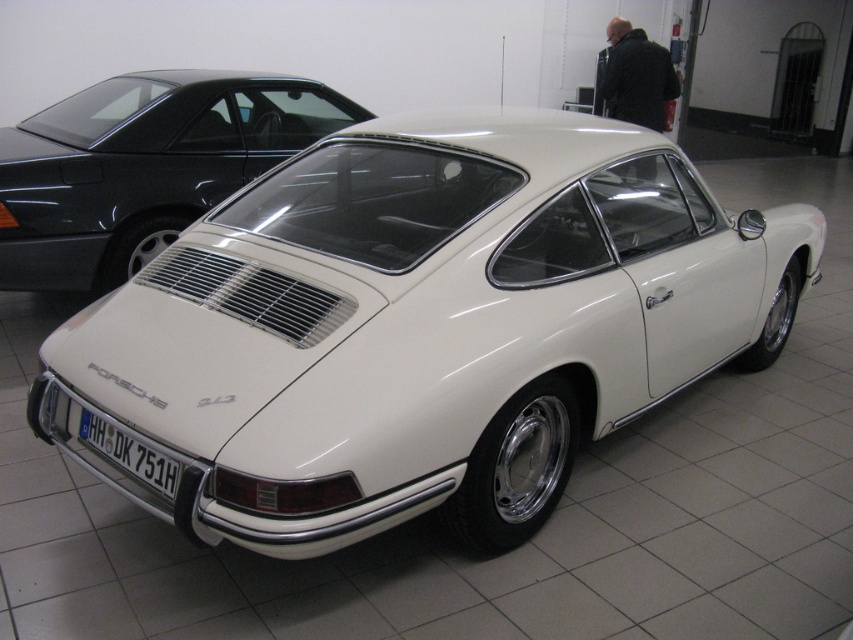
You are a car detailer working in a garage. You need to clean the white glossy car at center and the white plastic license plate at center. If your spray bottle has a range of 3 feet, can you reach the license plate from the car without moving either object?

The white glossy car at center is 3.66 feet from the white plastic license plate at center. Since the spray bottle only reaches 3 feet, you cannot spray the license plate from the car without moving them closer.